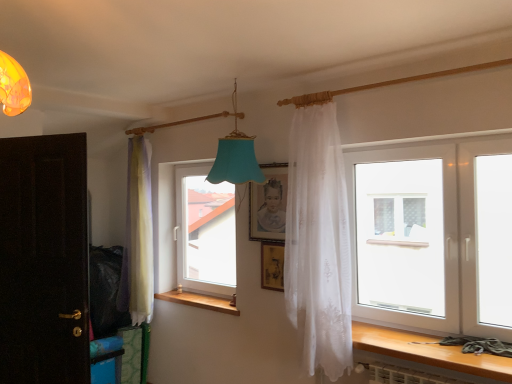
Question: Can you confirm if dark wood door at left is positioned to the right of matte wooden picture frame at center, the 1th picture frame from the top?

Choices:
 (A) no
 (B) yes

Answer: (A)

Question: Is there a large distance between dark wood door at left and matte wooden picture frame at center, the second picture frame positioned from the bottom?

Choices:
 (A) yes
 (B) no

Answer: (A)

Question: Is dark wood door at left positioned beyond the bounds of matte wooden picture frame at center, the 1th picture frame from the top?

Choices:
 (A) no
 (B) yes

Answer: (B)

Question: Is dark wood door at left to the left of matte wooden picture frame at center, the second picture frame positioned from the bottom, from the viewer's perspective?

Choices:
 (A) yes
 (B) no

Answer: (A)

Question: Is dark wood door at left behind matte wooden picture frame at center, the 1th picture frame from the top?

Choices:
 (A) no
 (B) yes

Answer: (A)

Question: Is dark wood door at left oriented towards matte wooden picture frame at center, the second picture frame positioned from the bottom?

Choices:
 (A) no
 (B) yes

Answer: (A)

Question: Is wooden frame at center, positioned as the second picture frame in top-to-bottom order, bigger than transparent glass window at center, which is counted as the second window, starting from the right?

Choices:
 (A) yes
 (B) no

Answer: (B)

Question: Can you confirm if wooden frame at center, which ranks as the 1th picture frame in bottom-to-top order, is shorter than transparent glass window at center, which is the 1th window in back-to-front order?

Choices:
 (A) no
 (B) yes

Answer: (B)

Question: Is wooden frame at center, positioned as the second picture frame in top-to-bottom order, next to transparent glass window at center, which is counted as the second window, starting from the right, and touching it?

Choices:
 (A) no
 (B) yes

Answer: (A)

Question: Is transparent glass window at center, which is counted as the second window, starting from the right, at the back of wooden frame at center, positioned as the second picture frame in top-to-bottom order?

Choices:
 (A) no
 (B) yes

Answer: (A)

Question: Is the position of wooden frame at center, which ranks as the 1th picture frame in bottom-to-top order, less distant than that of transparent glass window at center, which is the 1th window in back-to-front order?

Choices:
 (A) no
 (B) yes

Answer: (B)

Question: Is wooden frame at center, positioned as the second picture frame in top-to-bottom order, further to the viewer compared to transparent glass window at center, which is counted as the second window, starting from the right?

Choices:
 (A) no
 (B) yes

Answer: (A)

Question: From a real-world perspective, is dark wood door at left physically above wooden at left?

Choices:
 (A) no
 (B) yes

Answer: (B)